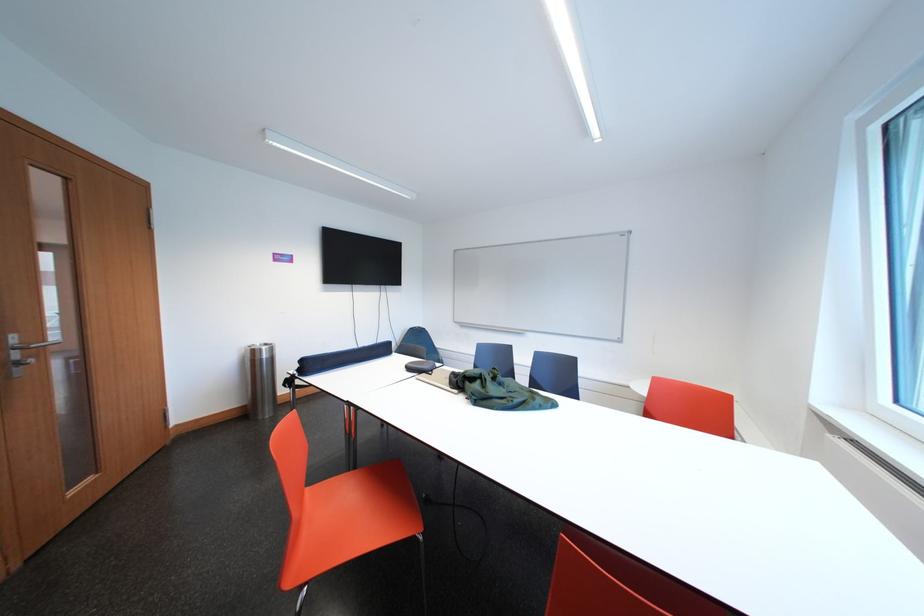
Find where to sit the orange chair sitting surface. Please return your answer as a coordinate pair (x, y).

(354, 516)